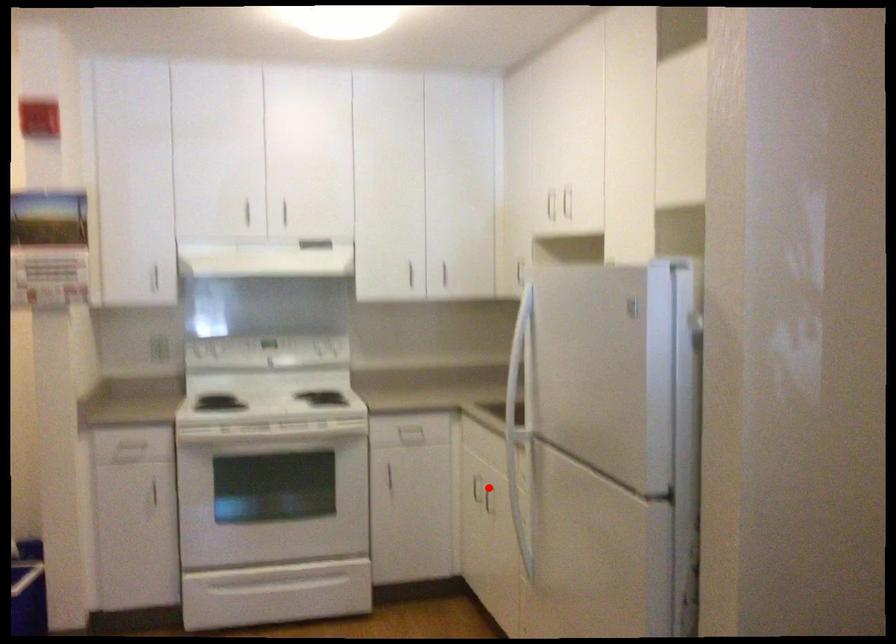
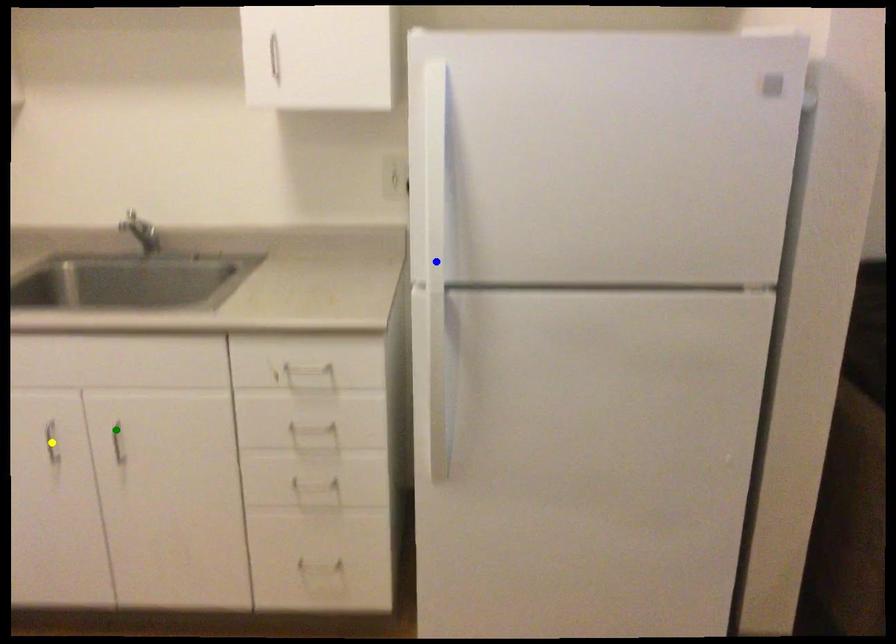
Question: I am providing you with two images of the same scene from different viewpoints. A red point is marked on the first image. You are given multiple points on the second image. Which mark in image 2 goes with the point in image 1?

Choices:
 (A) green point
 (B) yellow point
 (C) blue point

Answer: (A)